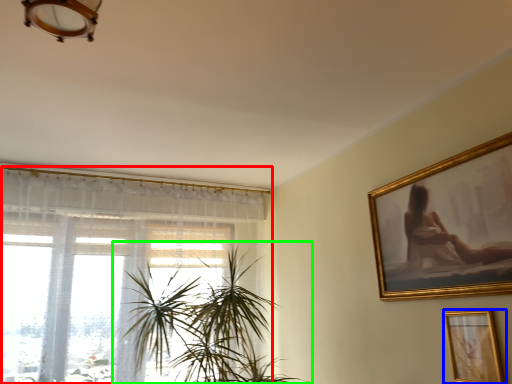
Question: Which object is positioned farthest from window (highlighted by a red box)? Select from picture frame (highlighted by a blue box) and houseplant (highlighted by a green box).

Choices:
 (A) picture frame
 (B) houseplant

Answer: (A)